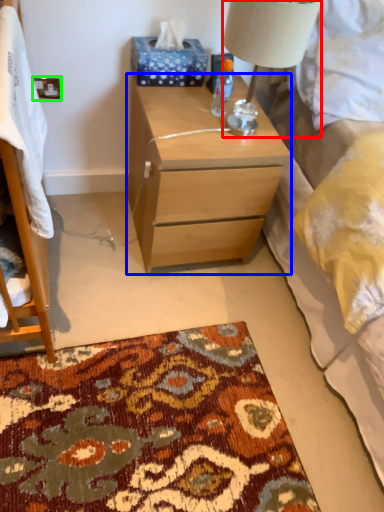
Question: Considering the real-world distances, which object is farthest from lamp (highlighted by a red box)? nightstand (highlighted by a blue box) or power outlet (highlighted by a green box)?

Choices:
 (A) nightstand
 (B) power outlet

Answer: (B)